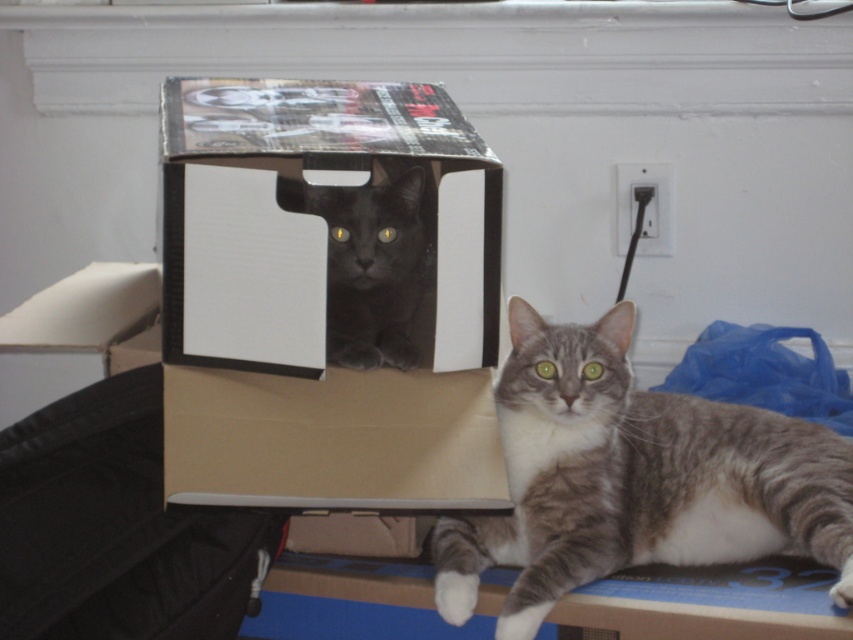
Question: Is cardboard box at center closer to the viewer compared to cardboard box at lower center?

Choices:
 (A) yes
 (B) no

Answer: (A)

Question: Is cardboard box at center bigger than cardboard box at lower center?

Choices:
 (A) yes
 (B) no

Answer: (A)

Question: Which of the following is the farthest from the observer?

Choices:
 (A) shiny black cat at center
 (B) cardboard box at center

Answer: (A)

Question: Does cardboard box at center lie in front of shiny black cat at center?

Choices:
 (A) no
 (B) yes

Answer: (B)

Question: Based on their relative distances, which object is farther from the cardboard box at center?

Choices:
 (A) gray tabby cat at center
 (B) shiny black cat at center
 (C) cardboard box at lower center
 (D) matte cardboard box at upper center

Answer: (C)

Question: Which of the following is the farthest from the observer?

Choices:
 (A) gray tabby cat at center
 (B) shiny black cat at center
 (C) cardboard box at center
 (D) matte cardboard box at upper center

Answer: (B)